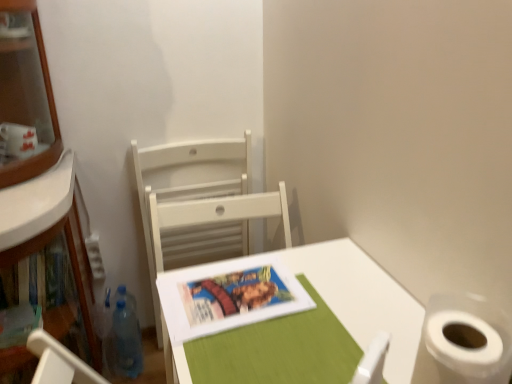
This screenshot has width=512, height=384. Identify the location of blank space situated above matte paper book cover at center (from a real-world perspective). (230, 293).